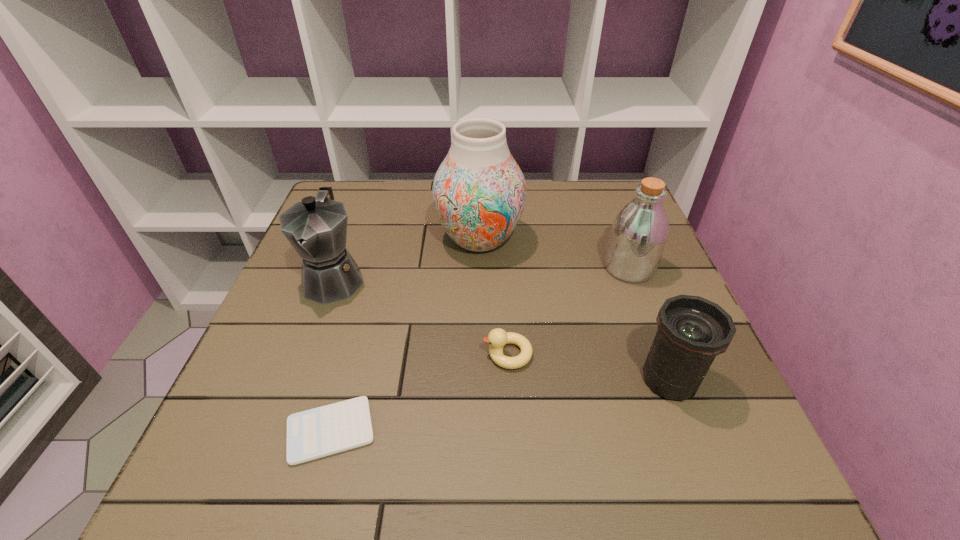
At what (x,y) coordinates should I click in order to perform the action: click on object that is at the near left corner. Please return your answer as a coordinate pair (x, y). Looking at the image, I should click on (319, 432).

At what (x,y) coordinates should I click in order to perform the action: click on vacant space at the far edge of the desktop. Please return your answer as a coordinate pair (x, y). The image size is (960, 540). Looking at the image, I should click on (538, 210).

Where is `vacant space at the left edge of the desktop`? vacant space at the left edge of the desktop is located at coordinates (275, 397).

Identify the location of free spot at the right edge of the desktop. (635, 284).

In the image, there is a desktop. Where is `vacant region at the far left corner`? The height and width of the screenshot is (540, 960). vacant region at the far left corner is located at coordinates (370, 200).

The width and height of the screenshot is (960, 540). Find the location of `vacant area at the far right corner of the desktop`. vacant area at the far right corner of the desktop is located at coordinates (588, 194).

What are the coordinates of `vacant space at the near right corner of the desktop` in the screenshot? It's located at (728, 465).

Find the location of a particular element. This screenshot has height=540, width=960. vacant area that lies between the bottle and the coffeepot is located at coordinates (482, 273).

Where is `empty location between the shortest object and the tallest object`? This screenshot has width=960, height=540. empty location between the shortest object and the tallest object is located at coordinates (405, 335).

Locate an element on the screen. vacant space that is in between the telephoto lens and the tallest object is located at coordinates (574, 309).